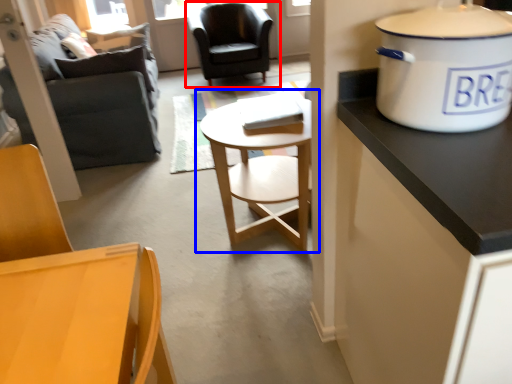
Question: Which object is further to the camera taking this photo, chair (highlighted by a red box) or coffee table (highlighted by a blue box)?

Choices:
 (A) chair
 (B) coffee table

Answer: (A)